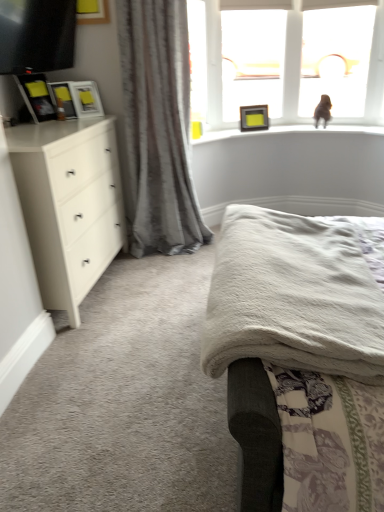
Question: Relative to white matte chest of drawers at left, is matte white picture frame at upper left, marked as the third picture frame in a left-to-right arrangement, in front or behind?

Choices:
 (A) behind
 (B) front

Answer: (A)

Question: From the image's perspective, relative to white matte chest of drawers at left, is matte white picture frame at upper left, arranged as the 3th picture frame when viewed from the front, above or below?

Choices:
 (A) above
 (B) below

Answer: (A)

Question: Estimate the real-world distances between objects in this image. Which object is closer to the white soft bed at upper center?

Choices:
 (A) matte white picture frame at upper left, which is the second picture frame from back to front
 (B) transparent plastic frame at upper center, the 2th window screen when ordered from right to left
 (C) white matte chest of drawers at left
 (D) matte black picture frame at left, placed as the first picture frame when sorted from left to right
 (E) matte black picture frame at left, which is the 2th picture frame in left-to-right order

Answer: (C)

Question: Estimate the real-world distances between objects in this image. Which object is farther from the matte black picture frame at left, which ranks as the 2th picture frame in front-to-back order?

Choices:
 (A) transparent plastic frame at upper center, the 2th window screen when ordered from right to left
 (B) transparent glass window at upper right, the 2th window screen positioned from the left
 (C) matte black tv at upper left
 (D) gray textured curtain at left
 (E) matte black picture frame at upper center, acting as the 4th picture frame starting from the left

Answer: (B)